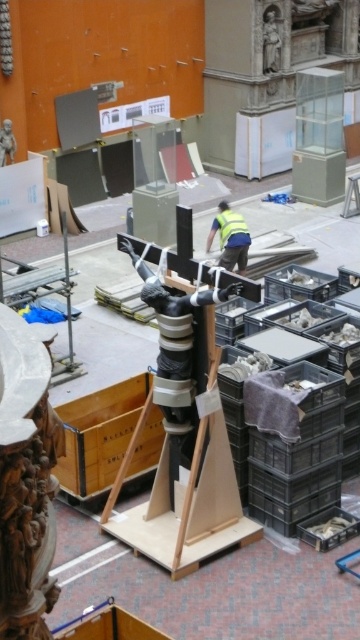
Looking at this image, you are standing in the museum gallery and want to take a photo. There are two points marked in the scene, point (x=140, y=262) and point (x=209, y=237). Which point should you focus on to ensure it appears larger in your photo?

Point (x=140, y=262) should be focused on because it is closer to the camera, making it appear larger in the photo compared to point (x=209, y=237) which is further away.

You are an art conservator assessing the space to ensure the safety of the black matte crucifix at center. Given that the yellow reflective vest at center belongs to a worker nearby, which object occupies more space in the scene?

The black matte crucifix at center has a larger size compared to the yellow reflective vest at center, so it occupies more space in the scene.

You are a visitor in the museum and you see the black matte crucifix at center and the yellow reflective vest at center. Which object is positioned to the left?

The black matte crucifix at center is positioned to the left of the yellow reflective vest at center.